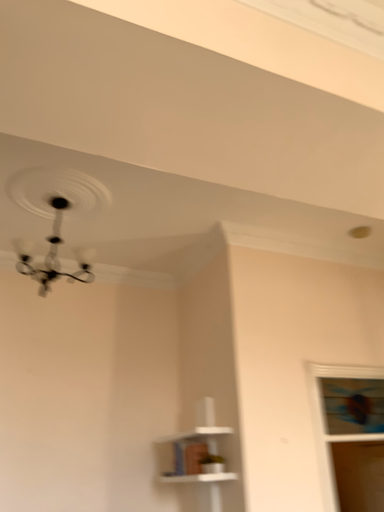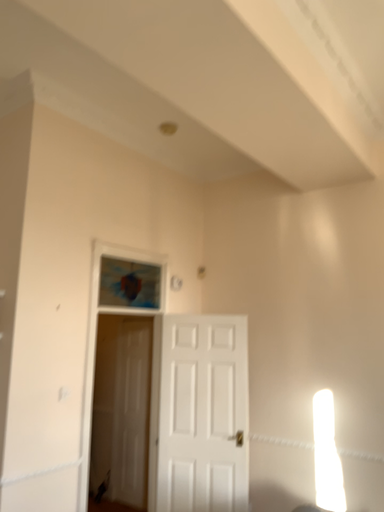
Question: How did the camera likely rotate when shooting the video?

Choices:
 (A) rotated downward
 (B) rotated upward

Answer: (A)